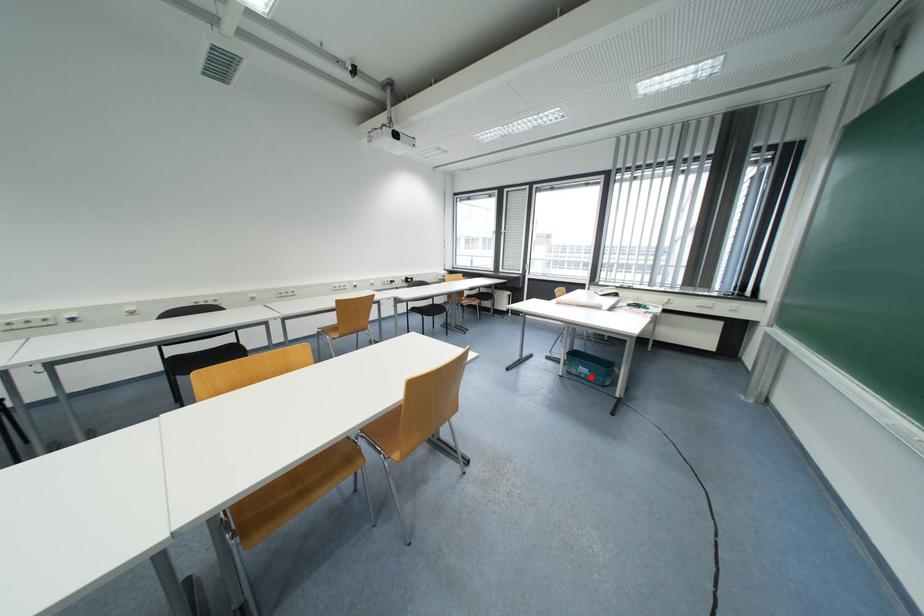
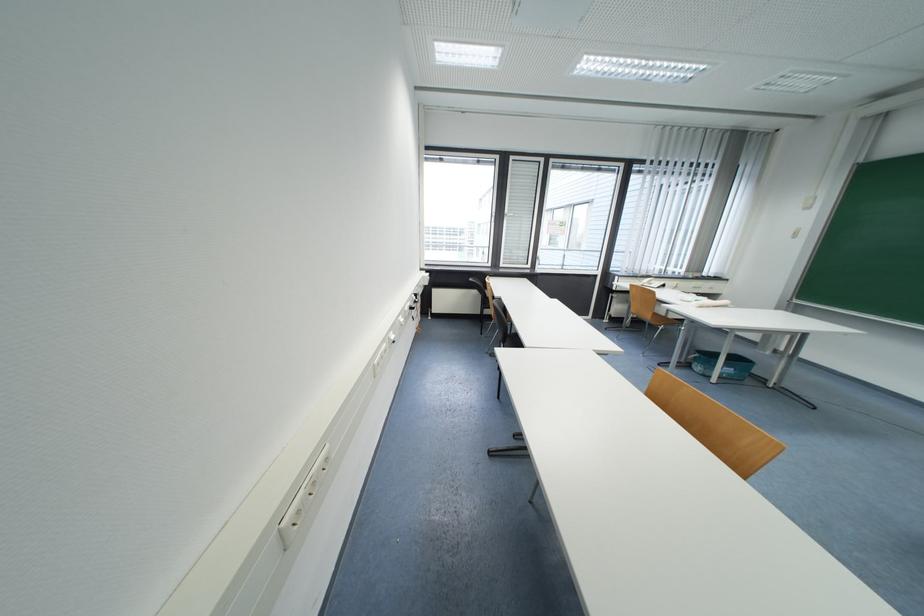
Locate, in the second image, the point that corresponds to the highlighted location in the first image.

(734, 377)